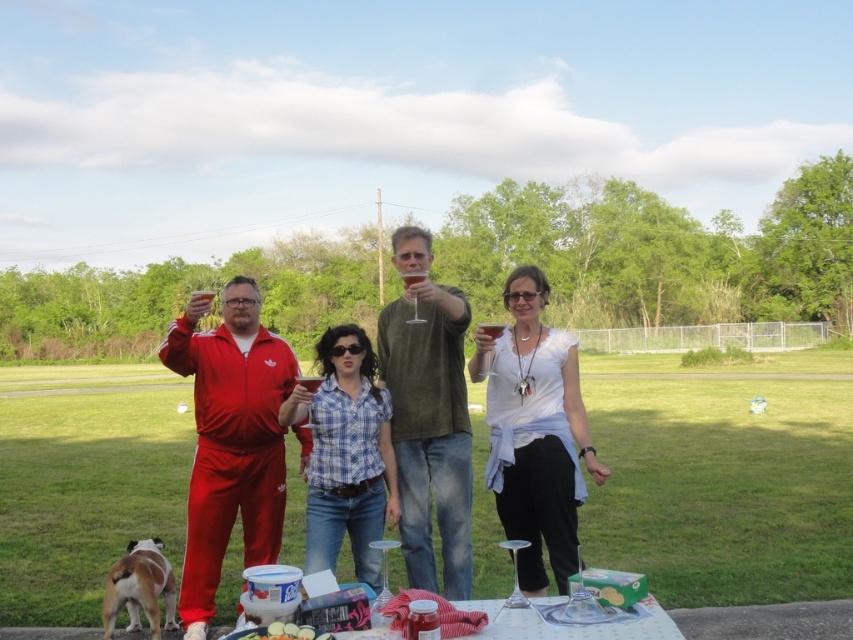
Question: Is matte red tracksuit at center wider than translucent glass at center?

Choices:
 (A) no
 (B) yes

Answer: (B)

Question: Which object is closer to the camera taking this photo?

Choices:
 (A) white creamy cheese at lower center
 (B) white cotton shirt at center
 (C) translucent glass at center

Answer: (A)

Question: Which of the following is the closest to the observer?

Choices:
 (A) white creamy cheese at lower center
 (B) clear glassware at center

Answer: (A)

Question: Can you confirm if matte red tracksuit at center is wider than clear glassware at center?

Choices:
 (A) no
 (B) yes

Answer: (B)

Question: Among these objects, which one is farthest from the camera?

Choices:
 (A) green textured shirt at center
 (B) clear glassware at center
 (C) translucent glass at center

Answer: (A)

Question: Is white cotton shirt at center closer to the viewer compared to translucent glass at center?

Choices:
 (A) yes
 (B) no

Answer: (A)